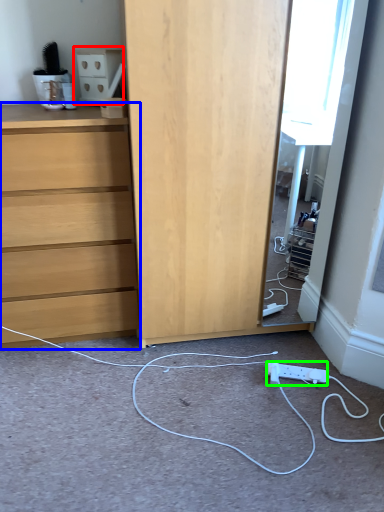
Question: Which object is the closest to the cabinetry (highlighted by a red box)? Choose among these: chest of drawers (highlighted by a blue box) or electric outlet (highlighted by a green box).

Choices:
 (A) chest of drawers
 (B) electric outlet

Answer: (A)